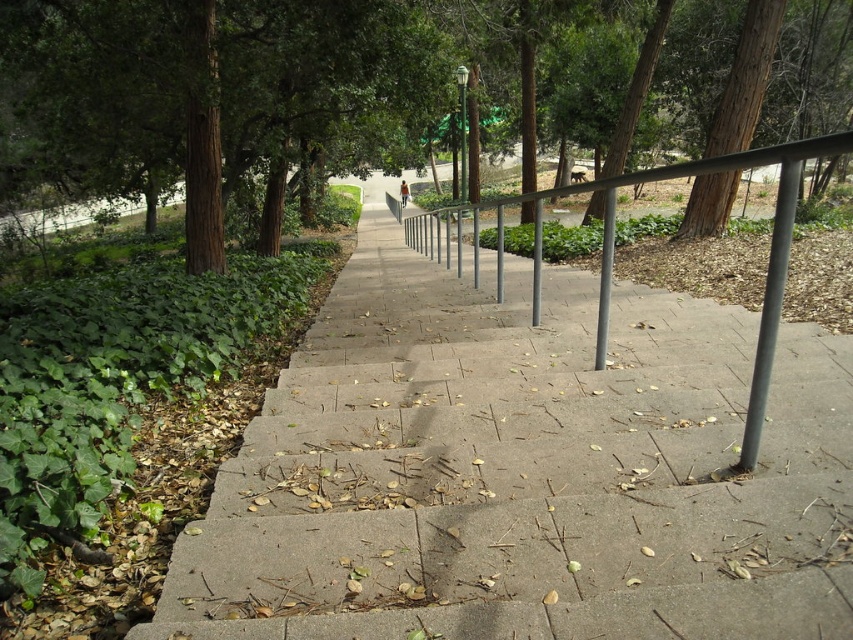
You are standing at the bottom of the steps and want to know which object is taller between the brown textured tree at upper left and the metallic gray balustrade at center. Can you tell me?

The brown textured tree at upper left is taller than the metallic gray balustrade at center.

You are a maintenance worker needing to reach the gray metallic pole at right from the metallic gray balustrade at center. Given that your tool cart is 2 meters wide, can you safely maneuver it through the space between them?

The distance between the metallic gray balustrade at center and the gray metallic pole at right is 7.68 meters. Since the tool cart is only 2 meters wide, there is sufficient space to maneuver it safely between them.

You are a painter standing at the bottom of the steps and want to paint the concrete at center and the metallic gray balustrade at center. Which object will require you to look upwards more to paint its top?

The metallic gray balustrade at center requires looking upwards more to paint its top because it has a greater height than the concrete at center.